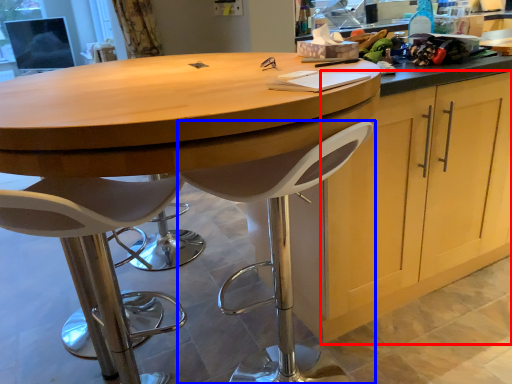
Question: Which of the following is the closest to the observer, cabinetry (highlighted by a red box) or chair (highlighted by a blue box)?

Choices:
 (A) cabinetry
 (B) chair

Answer: (B)